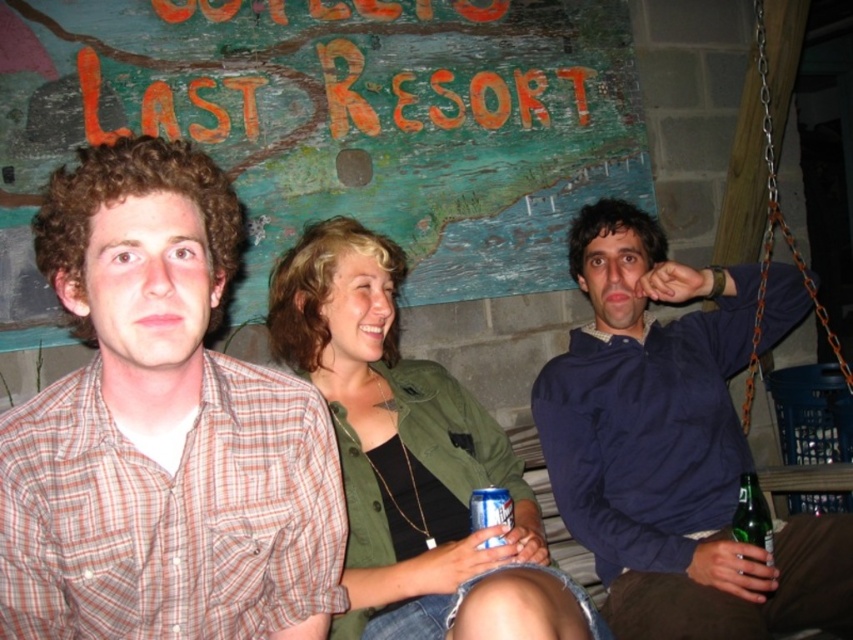
Is plaid cotton shirt at left thinner than green glass bottle at lower right?

No.

You are a GUI agent. You are given a task and a screenshot of the screen. Output one action in this format:
    pyautogui.click(x=<x>, y=<y>)
    Task: Click on the plaid cotton shirt at left
    The image size is (853, 640).
    Given the screenshot: What is the action you would take?
    (x=161, y=429)

Identify the location of plaid cotton shirt at left. (161, 429).

Identify the location of plaid cotton shirt at left. The image size is (853, 640). (161, 429).

Who is positioned more to the left, green glass bottle at lower right or blue metallic can at center?

blue metallic can at center

From the picture: Does green glass bottle at lower right have a greater height compared to blue metallic can at center?

Indeed, green glass bottle at lower right has a greater height compared to blue metallic can at center.

Describe the element at coordinates (752, 516) in the screenshot. Image resolution: width=853 pixels, height=640 pixels. I see `green glass bottle at lower right` at that location.

Image resolution: width=853 pixels, height=640 pixels. I want to click on green glass bottle at lower right, so click(x=752, y=516).

Does green matte jacket at center appear under green glass bottle at lower right?

Actually, green matte jacket at center is above green glass bottle at lower right.

The image size is (853, 640). Find the location of `green matte jacket at center`. green matte jacket at center is located at coordinates (409, 458).

The height and width of the screenshot is (640, 853). Identify the location of green matte jacket at center. (409, 458).